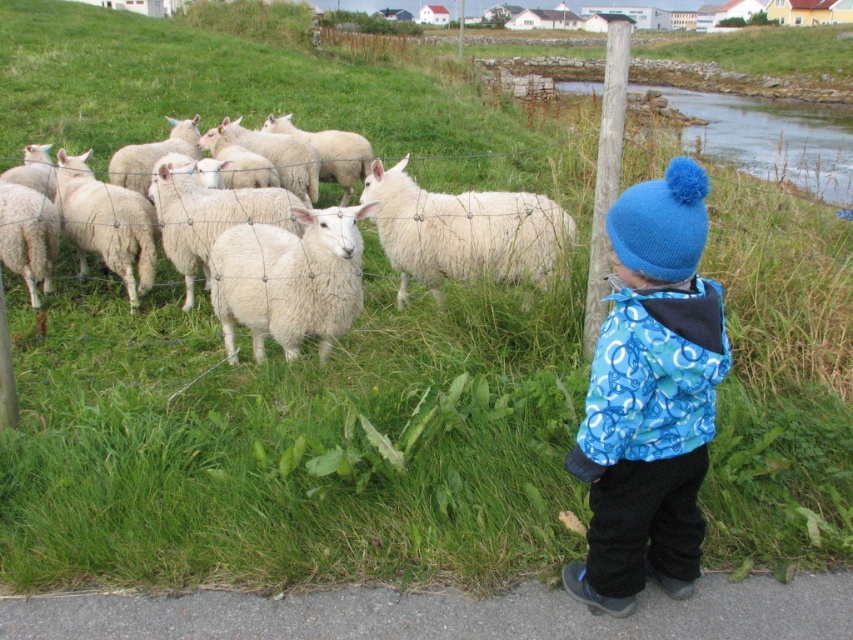
Can you confirm if blue knitted hat at upper right is bigger than white woolly sheep at left?

No.

Where is `blue knitted hat at upper right`? This screenshot has width=853, height=640. blue knitted hat at upper right is located at coordinates (648, 397).

Between point (640, 268) and point (556, 232), which one is positioned in front?

Positioned in front is point (640, 268).

Where is `blue knitted hat at upper right`? blue knitted hat at upper right is located at coordinates (648, 397).

Can you confirm if blue knitted hat at upper right is positioned below white woolen sheep at center?

Yes.

Does blue knitted hat at upper right have a lesser height compared to white woolen sheep at center?

Incorrect, blue knitted hat at upper right's height does not fall short of white woolen sheep at center's.

Consider the image. Who is more forward, (x=622, y=616) or (x=235, y=291)?

Point (x=622, y=616) is more forward.

Locate an element on the screen. blue knitted hat at upper right is located at coordinates (648, 397).

Does blue knitted hat at upper right have a smaller size compared to white woolly sheep at center?

Indeed, blue knitted hat at upper right has a smaller size compared to white woolly sheep at center.

Can you confirm if blue knitted hat at upper right is positioned to the right of white woolly sheep at center?

Correct, you'll find blue knitted hat at upper right to the right of white woolly sheep at center.

The width and height of the screenshot is (853, 640). I want to click on blue knitted hat at upper right, so click(648, 397).